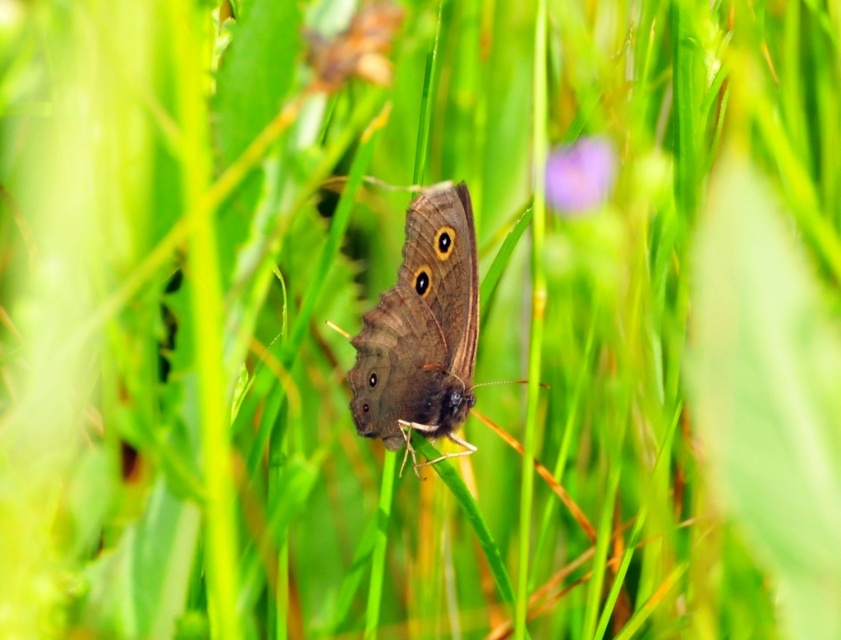
You are a nature photographer aiming to capture the brown matte butterfly at center and the brown textured leaf at upper center in your shot. Based on their sizes, which object would appear larger in the photo?

The brown matte butterfly at center would appear larger in the photo because its width surpasses that of the brown textured leaf at upper center.

You are a photographer aiming to capture a closeup of the brown matte butterfly at center and the purple matte flower at upper center in the same frame. Given their current distance, will you need to adjust your camera lens to a wider angle to include both subjects without moving the camera?

The brown matte butterfly at center and the purple matte flower at upper center are 12.74 inches apart. To capture both in the same frame without moving the camera, you would need to adjust the camera lens to a wider angle since the distance between them requires a broader field of view.

You are a gardener who needs to place a small decorative stone between the brown textured leaf at upper center and the purple matte flower at upper center. The stone is 10 inches wide. Will there be enough space between them to fit the stone?

The distance between the brown textured leaf at upper center and the purple matte flower at upper center is 27.60 inches. Since the stone is only 10 inches wide, there is sufficient space to place it between them.